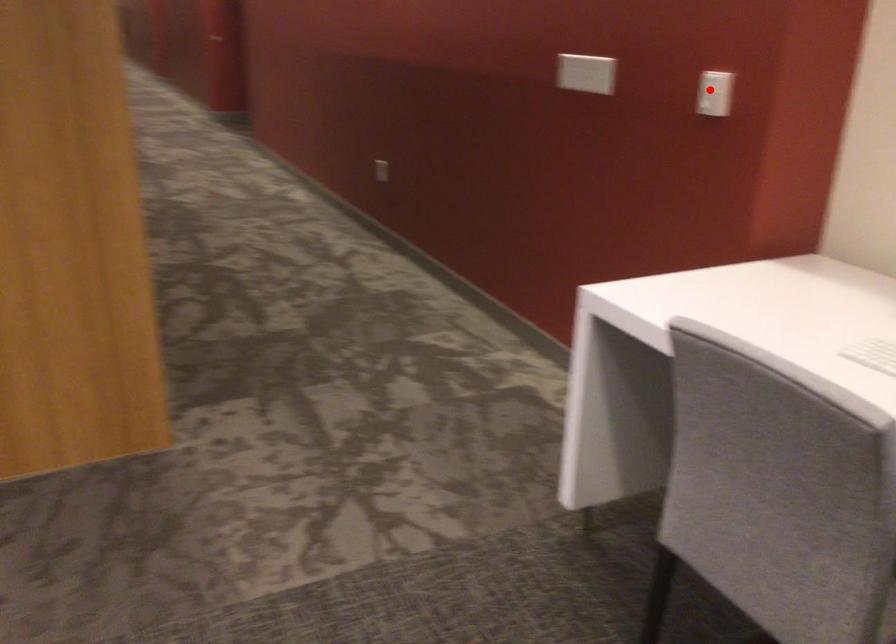
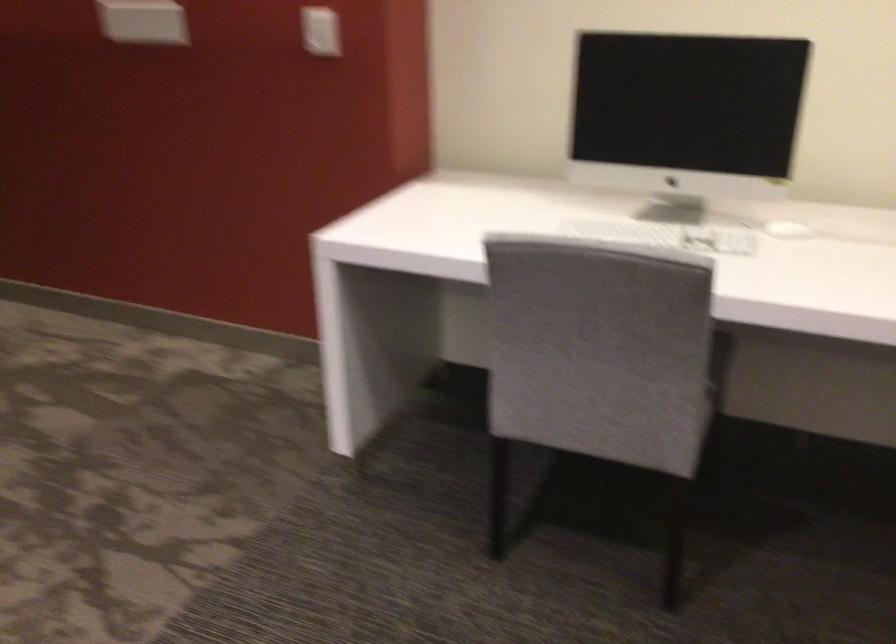
Locate, in the second image, the point that corresponds to the highlighted location in the first image.

(321, 31)